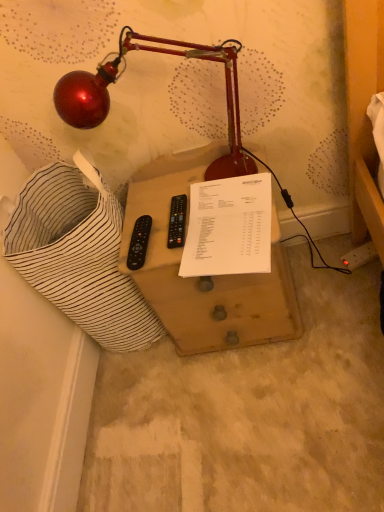
Question: Is black plastic remote at center, acting as the second control starting from the left, wider than wooden drawer at center?

Choices:
 (A) no
 (B) yes

Answer: (A)

Question: Is black plastic remote at center, acting as the second control starting from the left, at the right side of wooden drawer at center?

Choices:
 (A) no
 (B) yes

Answer: (A)

Question: From the image's perspective, is black plastic remote at center, acting as the second control starting from the left, located above wooden drawer at center?

Choices:
 (A) no
 (B) yes

Answer: (B)

Question: Is there a large distance between black plastic remote at center, marked as the 1th control in a right-to-left arrangement, and wooden drawer at center?

Choices:
 (A) no
 (B) yes

Answer: (A)

Question: Is black plastic remote at center, acting as the second control starting from the left, at the left side of wooden drawer at center?

Choices:
 (A) no
 (B) yes

Answer: (B)

Question: Based on their sizes in the image, would you say metallic red lamp at upper left is bigger or smaller than white paper at center?

Choices:
 (A) big
 (B) small

Answer: (A)

Question: From a real-world perspective, is metallic red lamp at upper left physically located above or below white paper at center?

Choices:
 (A) below
 (B) above

Answer: (B)

Question: Relative to white paper at center, is metallic red lamp at upper left in front or behind?

Choices:
 (A) front
 (B) behind

Answer: (A)

Question: Considering the positions of point (79, 104) and point (240, 244), is point (79, 104) closer or farther from the camera than point (240, 244)?

Choices:
 (A) closer
 (B) farther

Answer: (A)

Question: From a real-world perspective, is black plastic remote at center, acting as the second control starting from the left, physically located above or below black plastic remote at center-left, arranged as the second control when viewed from the right?

Choices:
 (A) above
 (B) below

Answer: (B)

Question: Looking at the image, does black plastic remote at center, acting as the second control starting from the left, seem bigger or smaller compared to black plastic remote at center-left, arranged as the second control when viewed from the right?

Choices:
 (A) big
 (B) small

Answer: (B)

Question: In terms of height, does black plastic remote at center, acting as the second control starting from the left, look taller or shorter compared to black plastic remote at center-left, arranged as the second control when viewed from the right?

Choices:
 (A) short
 (B) tall

Answer: (A)

Question: Is black plastic remote at center, marked as the 1th control in a right-to-left arrangement, wider or thinner than black plastic remote at center-left, the first control in the left-to-right sequence?

Choices:
 (A) thin
 (B) wide

Answer: (B)

Question: Is point (258, 190) closer or farther from the camera than point (142, 223)?

Choices:
 (A) closer
 (B) farther

Answer: (A)

Question: Based on their positions, is white paper at center located to the left or right of black plastic remote at center-left, the first control in the left-to-right sequence?

Choices:
 (A) right
 (B) left

Answer: (A)